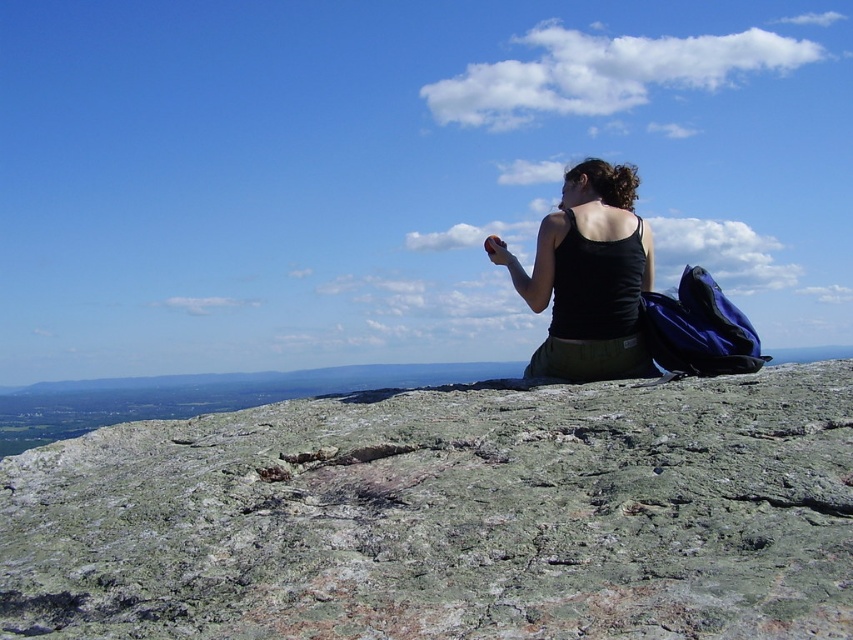
This screenshot has height=640, width=853. In order to click on green rough rock at center in this screenshot , I will do `click(450, 516)`.

Which is more to the left, green rough rock at center or black tank top at center?

green rough rock at center

At what (x,y) coordinates should I click in order to perform the action: click on green rough rock at center. Please return your answer as a coordinate pair (x, y). Looking at the image, I should click on (450, 516).

The image size is (853, 640). Identify the location of green rough rock at center. (450, 516).